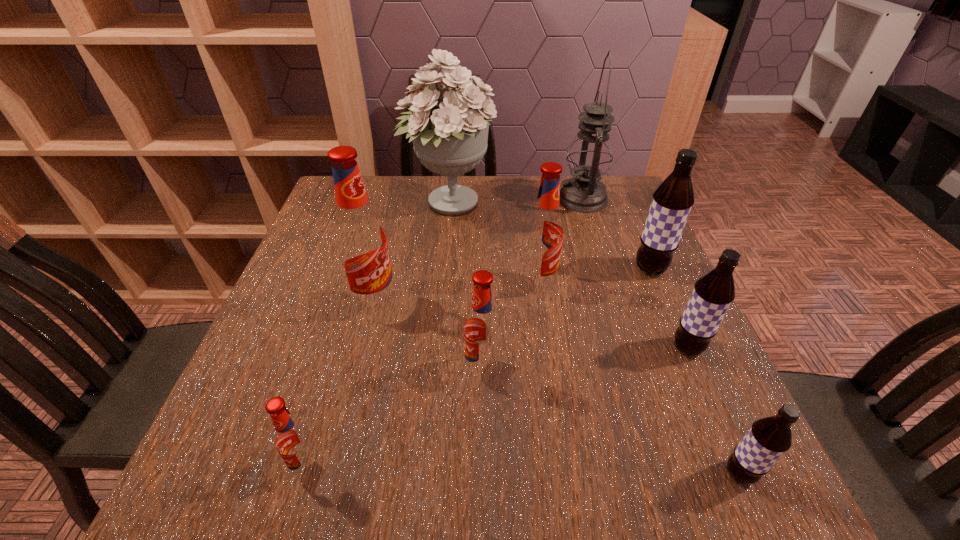
You are a GUI agent. You are given a task and a screenshot of the screen. Output one action in this format:
    pyautogui.click(x=<x>, y=<y>)
    Task: Click on the vacant space at the far left corner of the desktop
    
    Given the screenshot: What is the action you would take?
    pyautogui.click(x=334, y=212)

Where is `free space at the near left corner`? This screenshot has width=960, height=540. free space at the near left corner is located at coordinates (233, 488).

This screenshot has height=540, width=960. In the image, there is a desktop. Identify the location of free space at the far right corner. (601, 218).

Locate an element on the screen. The width and height of the screenshot is (960, 540). empty space between the tallest root beer and the second biggest brown root beer is located at coordinates (531, 325).

This screenshot has width=960, height=540. I want to click on free space between the nearest brown root beer and the third red root beer from left to right, so click(611, 422).

What are the coordinates of `free spot between the green bouquet and the nearest brown root beer` in the screenshot? It's located at (594, 339).

Identify the location of free space between the oil lamp and the second smallest brown root beer. The width and height of the screenshot is (960, 540). [635, 273].

Identify the location of vacant space that's between the fourth root beer from left to right and the second farthest brown root beer. (612, 316).

What are the coordinates of `free space between the third red root beer from left to right and the second smallest brown root beer` in the screenshot? It's located at (585, 359).

Where is `free space between the second red root beer from right to left and the nearest red root beer`? free space between the second red root beer from right to left and the nearest red root beer is located at coordinates (396, 418).